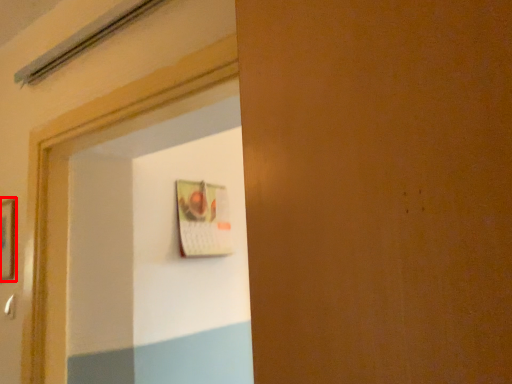
Question: Considering the relative positions of picture frame (annotated by the red box) and door handle in the image provided, where is picture frame (annotated by the red box) located with respect to the staircase?

Choices:
 (A) left
 (B) right

Answer: (A)